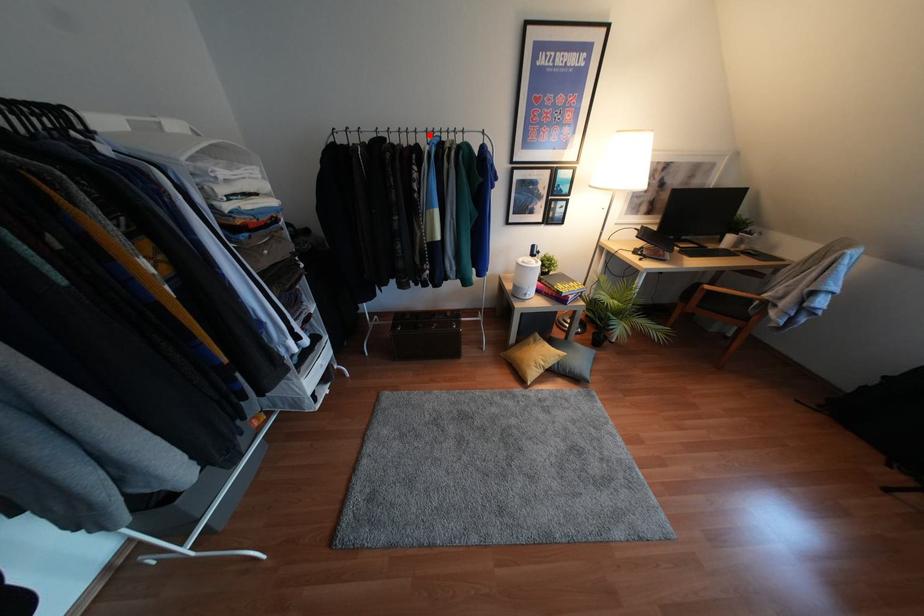
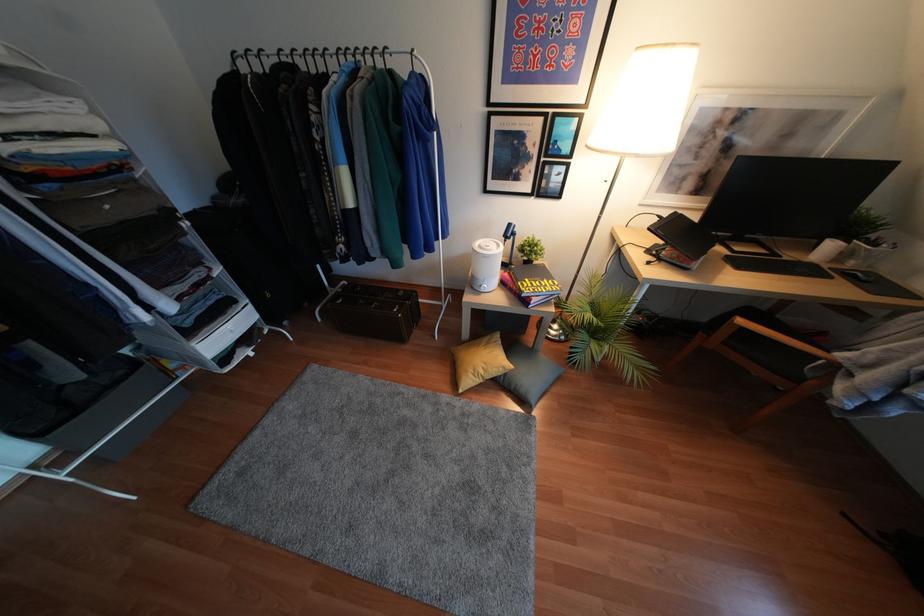
Question: I am providing you with two images of the same scene from different viewpoints. A red point is marked on the first image. Can you still see the location of the red point in image 2?

Choices:
 (A) Yes
 (B) No

Answer: (A)